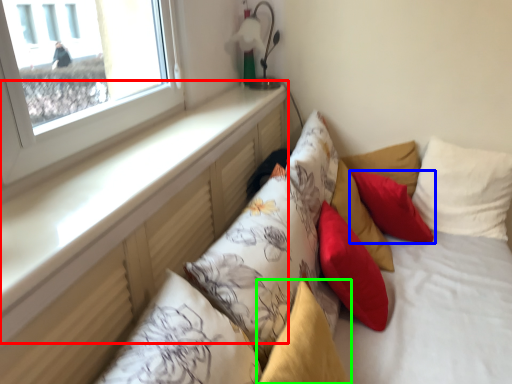
Question: Considering the real-world distances, which object is farthest from window sill (highlighted by a red box)? pillow (highlighted by a blue box) or pillow (highlighted by a green box)?

Choices:
 (A) pillow
 (B) pillow

Answer: (A)